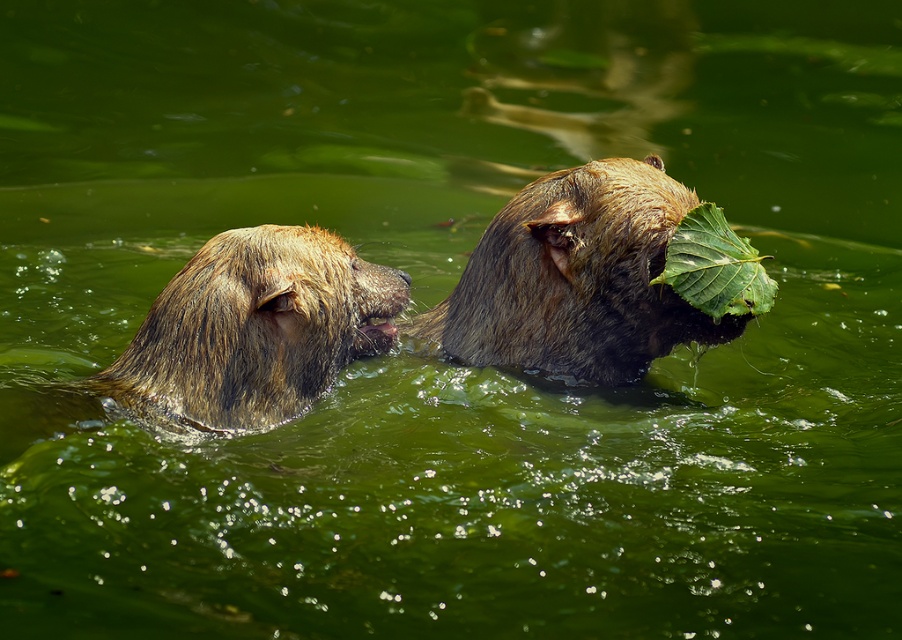
Question: Is brown furry bear at upper center smaller than green leafy at right?

Choices:
 (A) yes
 (B) no

Answer: (B)

Question: Which point appears farthest from the camera in this image?

Choices:
 (A) (539, 227)
 (B) (756, 300)

Answer: (A)

Question: Can you confirm if brown fur bear at left is bigger than green leafy at right?

Choices:
 (A) no
 (B) yes

Answer: (B)

Question: Among these points, which one is farthest from the camera?

Choices:
 (A) (272, 392)
 (B) (729, 307)

Answer: (B)

Question: Can you confirm if brown furry bear at upper center is positioned above brown fur bear at left?

Choices:
 (A) no
 (B) yes

Answer: (B)

Question: Which object is farther from the camera taking this photo?

Choices:
 (A) brown fur bear at left
 (B) brown furry bear at upper center
 (C) green leafy at right

Answer: (B)